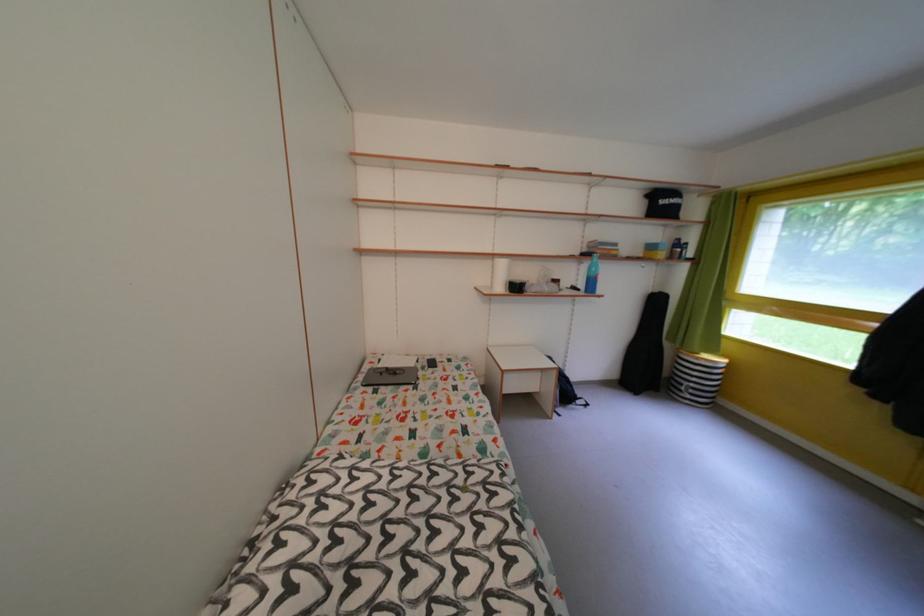
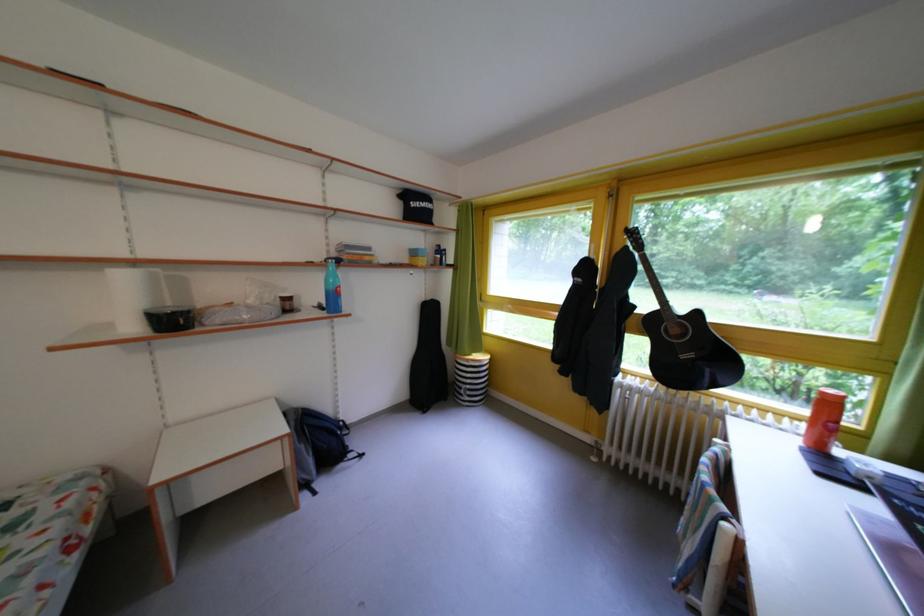
Locate, in the second image, the point that corresponds to the point at 584,294 in the first image.

(331, 313)